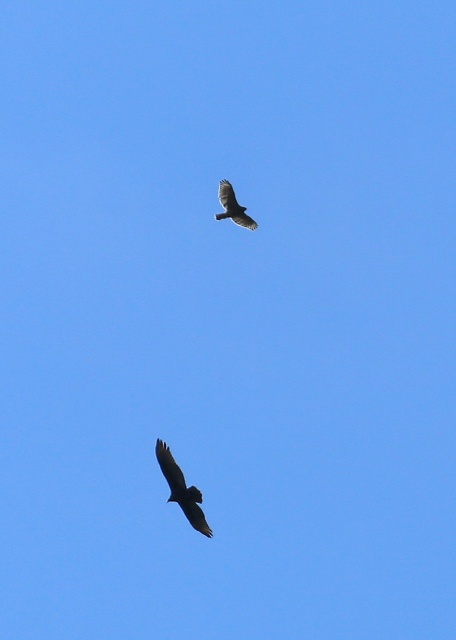
You are a birdwatcher observing two birds in the sky. You notice both have dark brown feathers at lower center and dark brown feathers at upper center. Which bird has its feathers positioned to the left of the other?

The dark brown feathers at lower center are positioned to the left of the dark brown feathers at upper center.